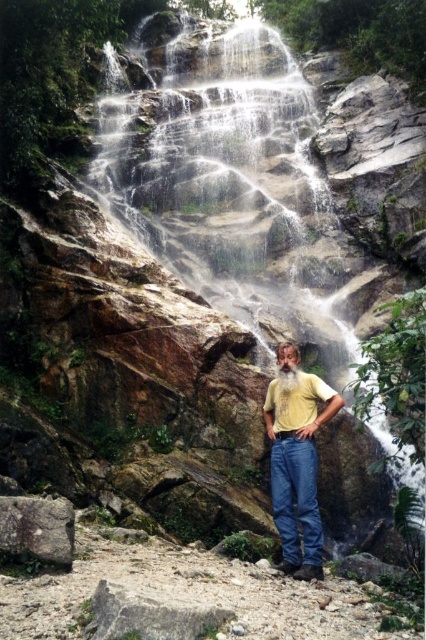
Question: Among these objects, which one is farthest from the camera?

Choices:
 (A) blue denim jeans at lower center
 (B) smooth gray rock at lower left
 (C) rocky textured waterfall at center

Answer: (C)

Question: Does rocky textured waterfall at center appear under smooth gray rock at lower left?

Choices:
 (A) yes
 (B) no

Answer: (B)

Question: In this image, where is yellow matte shirt at center located relative to smooth gray rock at lower left?

Choices:
 (A) left
 (B) right

Answer: (B)

Question: Which object is closer to the camera taking this photo?

Choices:
 (A) smooth gray rock at lower left
 (B) blue denim jeans at lower center

Answer: (A)

Question: Is blue denim jeans at lower center wider than smooth gray rock at lower left?

Choices:
 (A) no
 (B) yes

Answer: (A)

Question: Which of these objects is positioned farthest from the blue denim jeans at lower center?

Choices:
 (A) rocky textured waterfall at center
 (B) yellow matte shirt at center

Answer: (A)